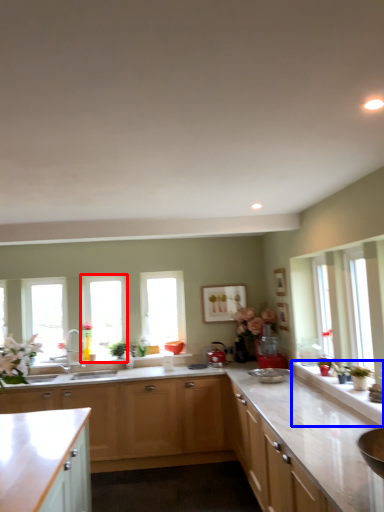
Question: Which point is closer to the camera, window (highlighted by a red box) or counter top (highlighted by a blue box)?

Choices:
 (A) window
 (B) counter top

Answer: (B)